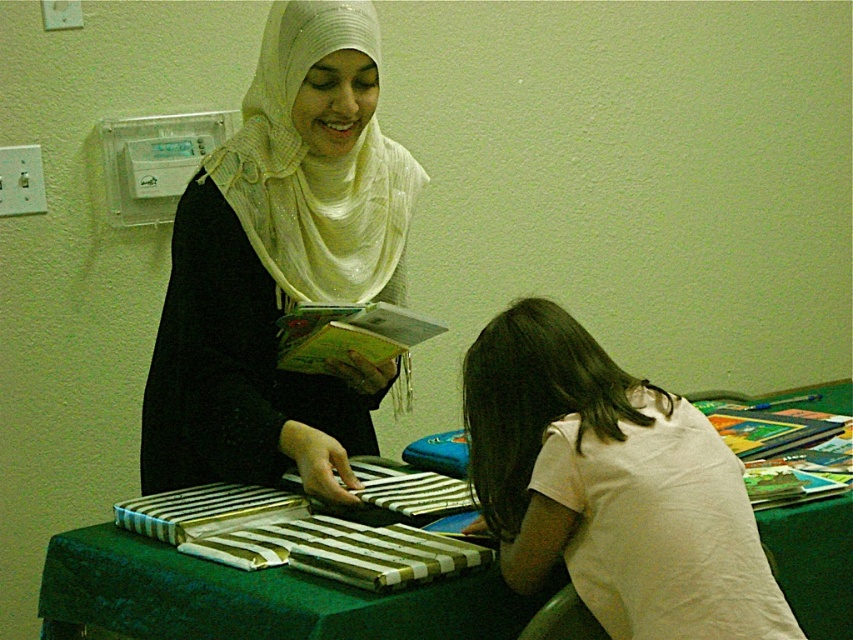
Question: Does white cotton shirt at lower right appear under hardcover book at center?

Choices:
 (A) yes
 (B) no

Answer: (A)

Question: Can you confirm if white cotton shirt at lower right is thinner than green fabric table at center?

Choices:
 (A) no
 (B) yes

Answer: (B)

Question: Does green fabric table at center appear under white sheer hijab at upper center?

Choices:
 (A) yes
 (B) no

Answer: (A)

Question: Which point is farther to the camera?

Choices:
 (A) (286, 6)
 (B) (490, 632)
 (C) (368, 225)
 (D) (302, 340)

Answer: (C)

Question: Which object appears closest to the camera in this image?

Choices:
 (A) matte white hijab at upper center
 (B) white cotton shirt at lower right

Answer: (B)

Question: Which object is positioned closest to the hardcover book at center?

Choices:
 (A) matte white hijab at upper center
 (B) white cotton shirt at lower right

Answer: (A)